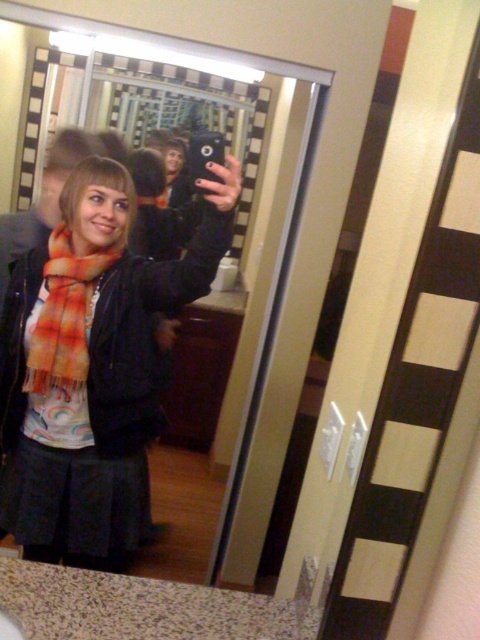
Does orange plaid scarf at center have a larger size compared to orange and white striped scarf at center?

Yes.

Is orange plaid scarf at center thinner than orange and white striped scarf at center?

No.

Is point (128, 458) closer to camera compared to point (79, 356)?

No, it is not.

The height and width of the screenshot is (640, 480). What are the coordinates of `orange plaid scarf at center` in the screenshot? It's located at (92, 365).